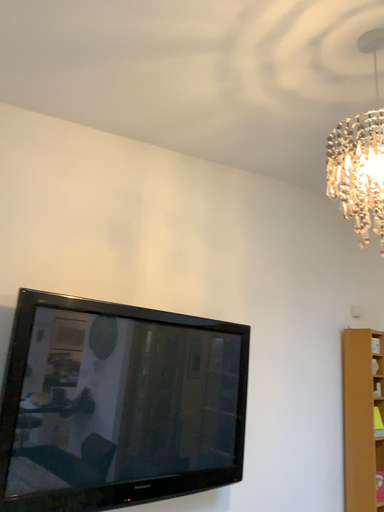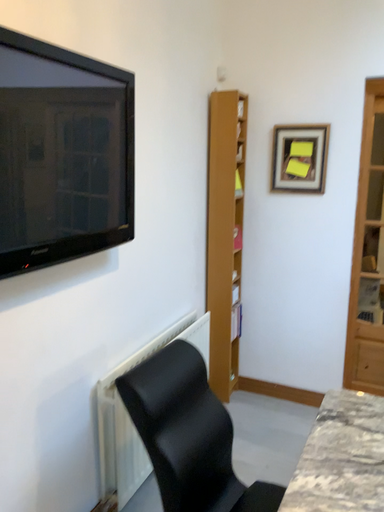
Question: How did the camera likely rotate when shooting the video?

Choices:
 (A) rotated right
 (B) rotated left

Answer: (A)